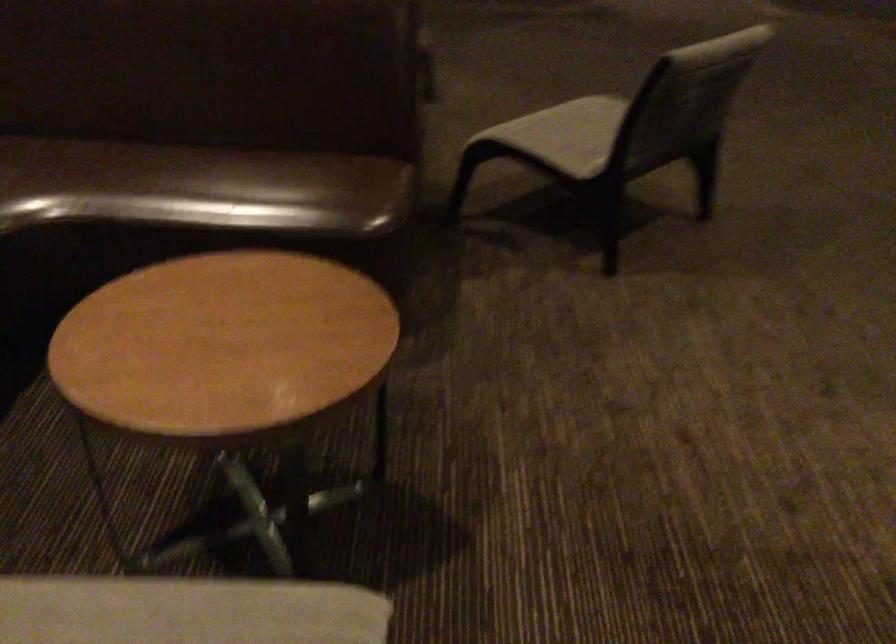
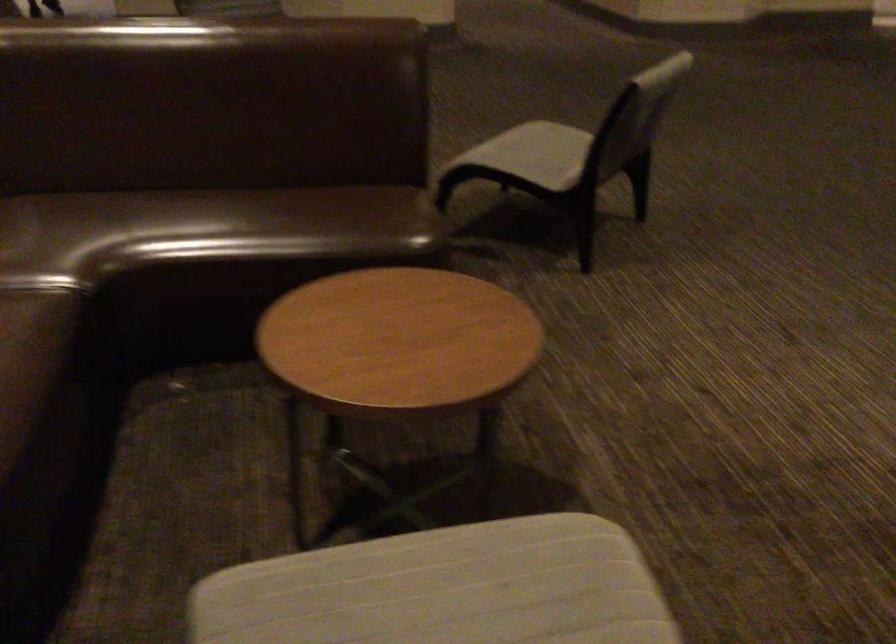
Question: Based on the continuous images, in which direction is the camera rotating? Reply with the corresponding letter.

Choices:
 (A) Left
 (B) Right
 (C) Up
 (D) Down

Answer: (B)